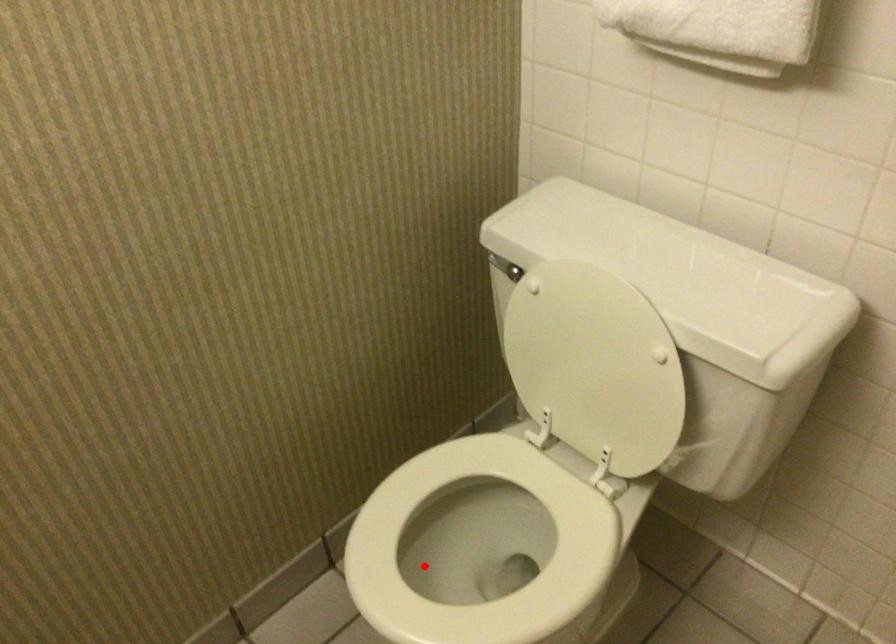
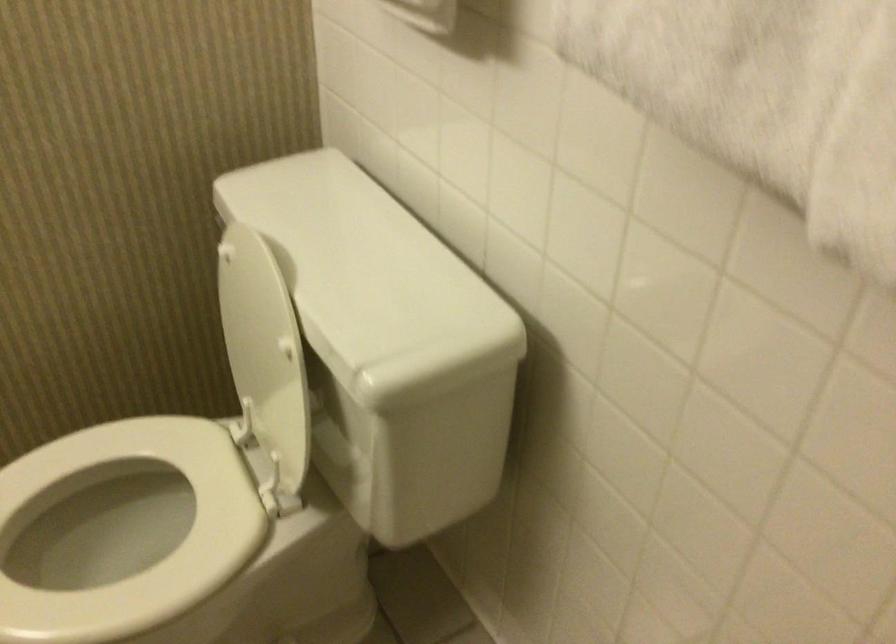
Locate, in the second image, the point that corresponds to the highlighted location in the first image.

(97, 545)